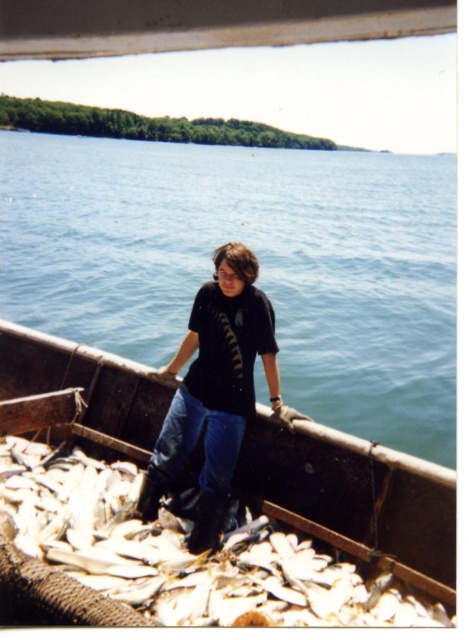
Can you confirm if white matte fish at lower center is wider than black matte shirt at center?

Correct, the width of white matte fish at lower center exceeds that of black matte shirt at center.

Is point (53, 529) positioned before point (209, 470)?

Yes, point (53, 529) is in front of point (209, 470).

You are a GUI agent. You are given a task and a screenshot of the screen. Output one action in this format:
    pyautogui.click(x=<x>, y=<y>)
    Task: Click on the white matte fish at lower center
    The height and width of the screenshot is (640, 469).
    Given the screenshot: What is the action you would take?
    (181, 556)

Between blue water at center and white matte fish at lower center, which one is positioned higher?

blue water at center is higher up.

Is point (74, 160) positioned in front of point (184, 556)?

No, it is not.

Where is `blue water at center`? Image resolution: width=469 pixels, height=640 pixels. blue water at center is located at coordinates (258, 259).

Does blue water at center appear over black matte shirt at center?

Indeed, blue water at center is positioned over black matte shirt at center.

Is point (22, 276) in front of point (248, 317)?

No, it is behind (248, 317).

Who is more forward, (x=156, y=161) or (x=136, y=509)?

Positioned in front is point (x=136, y=509).

Locate an element on the screen. blue water at center is located at coordinates (258, 259).